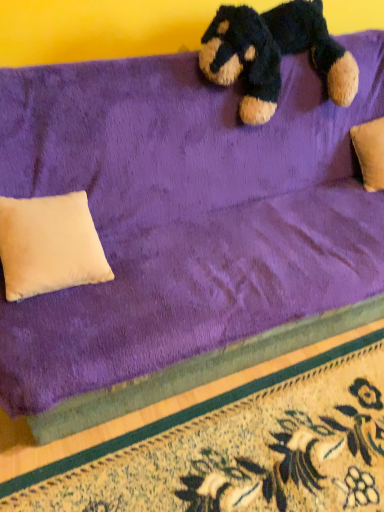
Question: From the image's perspective, is floral carpet at lower right positioned above or below beige suede pillow at lower left?

Choices:
 (A) below
 (B) above

Answer: (A)

Question: Is point (332, 416) positioned closer to the camera than point (3, 228)?

Choices:
 (A) closer
 (B) farther

Answer: (B)

Question: Estimate the real-world distances between objects in this image. Which object is closer to the beige suede pillow at lower left?

Choices:
 (A) floral carpet at lower right
 (B) velvety dark blue teddy bear at upper center

Answer: (A)

Question: Considering the real-world distances, which object is closest to the beige suede pillow at lower left?

Choices:
 (A) velvety dark blue teddy bear at upper center
 (B) floral carpet at lower right

Answer: (B)